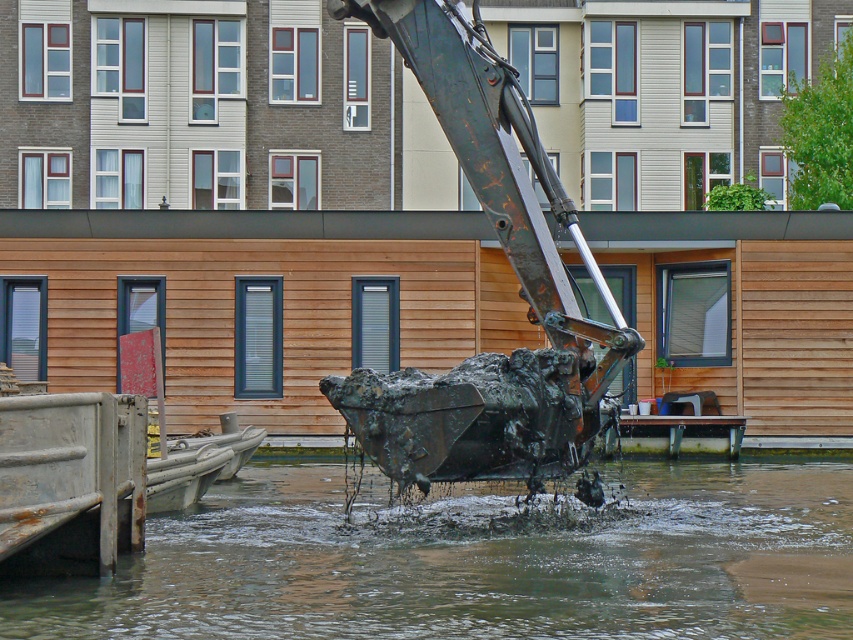
Question: Which point is closer to the camera taking this photo?

Choices:
 (A) (727, 634)
 (B) (180, 492)

Answer: (A)

Question: Does translucent water at center appear on the left side of smooth wooden dock at center?

Choices:
 (A) no
 (B) yes

Answer: (B)

Question: Among these points, which one is nearest to the camera?

Choices:
 (A) (706, 438)
 (B) (749, 576)
 (C) (221, 444)

Answer: (B)

Question: Which object is closer to the camera taking this photo?

Choices:
 (A) metallic gray boat at lower left
 (B) wooden boat at lower left

Answer: (A)

Question: Can you confirm if rusty metal excavator at center is smaller than smooth wooden dock at center?

Choices:
 (A) no
 (B) yes

Answer: (A)

Question: Is translucent water at center bigger than rusty metal excavator at center?

Choices:
 (A) yes
 (B) no

Answer: (A)